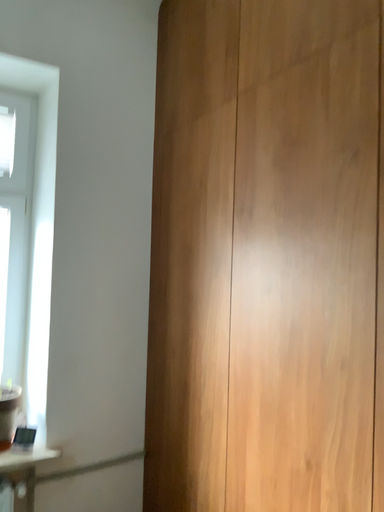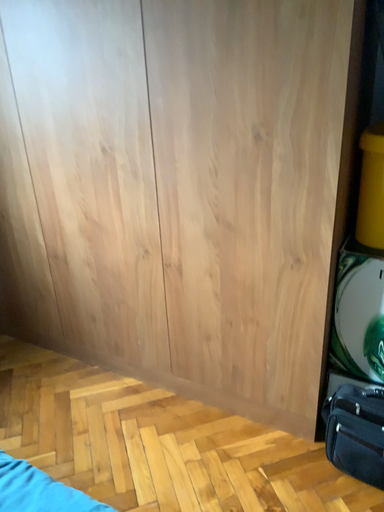
Question: How did the camera likely rotate when shooting the video?

Choices:
 (A) rotated downward
 (B) rotated upward

Answer: (A)